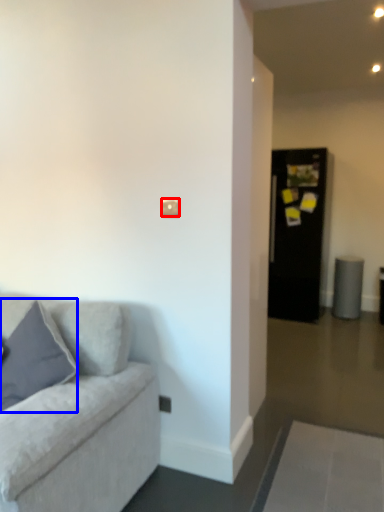
Question: Which object appears farthest to the camera in this image, light switch (highlighted by a red box) or pillow (highlighted by a blue box)?

Choices:
 (A) light switch
 (B) pillow

Answer: (A)